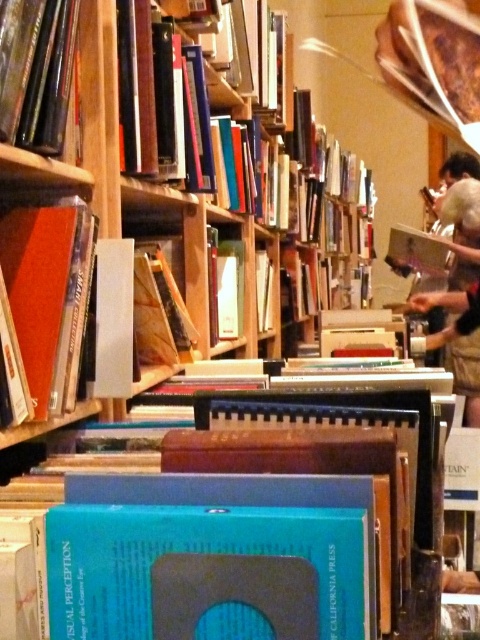
Find the location of a particular element. light brown fabric shirt at upper right is located at coordinates (458, 244).

The image size is (480, 640). What do you see at coordinates (458, 244) in the screenshot?
I see `light brown fabric shirt at upper right` at bounding box center [458, 244].

Which is in front, point (451, 364) or point (232, 272)?

Point (232, 272)

Identify the location of light brown fabric shirt at upper right. This screenshot has width=480, height=640. (458, 244).

Does blue hardcover book at center come behind matte orange book at left?

No, blue hardcover book at center is closer to the viewer.

Where is `blue hardcover book at center`? This screenshot has height=640, width=480. blue hardcover book at center is located at coordinates (206, 572).

Between point (49, 305) and point (223, 264), which one is positioned in front?

Point (49, 305) is more forward.

Is point (34, 384) behind point (211, 266)?

No, it is not.

The width and height of the screenshot is (480, 640). Describe the element at coordinates (48, 294) in the screenshot. I see `matte orange book at left` at that location.

The height and width of the screenshot is (640, 480). Identify the location of matte orange book at left. (48, 294).